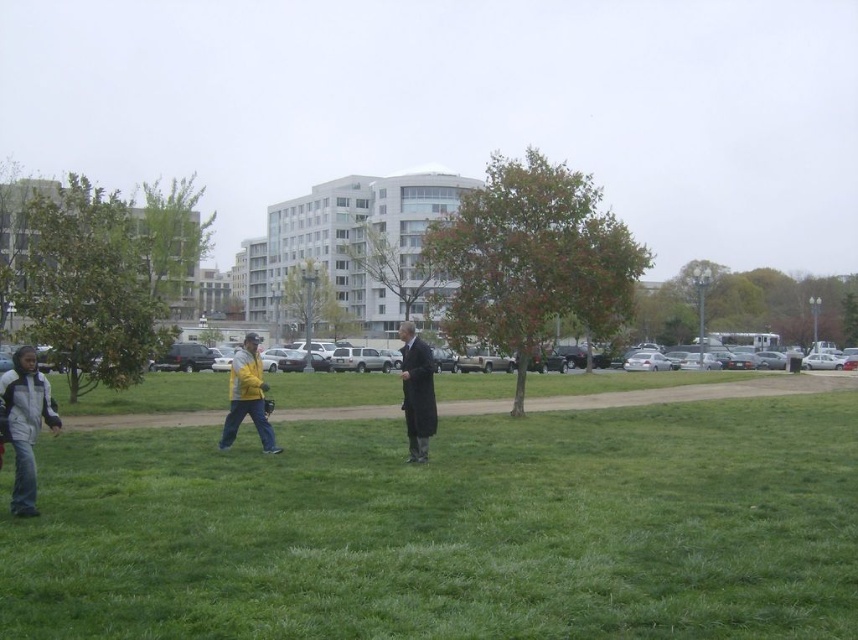
Does gray/white jacket at lower left have a greater height compared to dark gray wool coat at center?

No, gray/white jacket at lower left is not taller than dark gray wool coat at center.

Between gray/white jacket at lower left and dark gray wool coat at center, which one is positioned higher?

gray/white jacket at lower left is above.

Does point (26, 472) come farther from viewer compared to point (402, 364)?

No, it is in front of (402, 364).

What are the coordinates of `gray/white jacket at lower left` in the screenshot? It's located at (23, 422).

Between point (710, 586) and point (421, 376), which one is positioned behind?

The point (421, 376) is more distant.

From the picture: Who is more distant from viewer, (59,442) or (429,349)?

Point (59,442)

This screenshot has width=858, height=640. Find the location of `green grass at center`. green grass at center is located at coordinates (451, 529).

Which is behind, point (699, 506) or point (228, 426)?

Positioned behind is point (228, 426).

How distant is green grass at center from yellow jacket at center?

green grass at center and yellow jacket at center are 5.55 meters apart.

Is point (125, 632) closer to camera compared to point (233, 378)?

That is True.

You are a GUI agent. You are given a task and a screenshot of the screen. Output one action in this format:
    pyautogui.click(x=<x>, y=<y>)
    Task: Click on the green grass at center
    
    Given the screenshot: What is the action you would take?
    pyautogui.click(x=451, y=529)